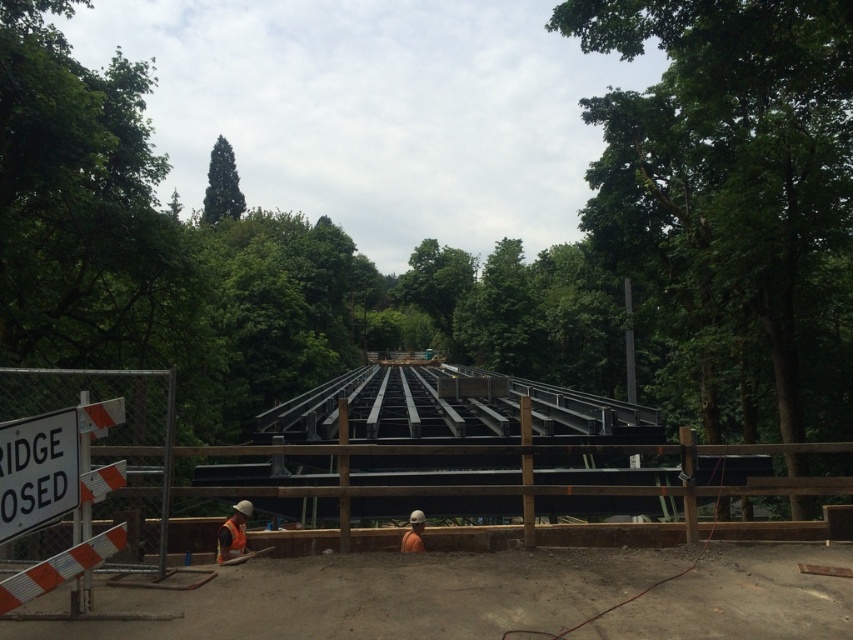
Question: Which object appears closest to the camera in this image?

Choices:
 (A) orange safety vest at lower center
 (B) black steel beams at center
 (C) orange fabric safety vest at lower center

Answer: (B)

Question: Among these objects, which one is nearest to the camera?

Choices:
 (A) orange fabric safety vest at lower center
 (B) orange safety vest at lower center
 (C) black steel beams at center

Answer: (C)

Question: Which point is farther to the camera?

Choices:
 (A) orange safety vest at lower center
 (B) orange fabric safety vest at lower center

Answer: (A)

Question: Does black steel beams at center appear over orange fabric safety vest at lower center?

Choices:
 (A) no
 (B) yes

Answer: (A)

Question: Does orange fabric safety vest at lower center appear over orange safety vest at lower center?

Choices:
 (A) yes
 (B) no

Answer: (A)

Question: Can you confirm if black steel beams at center is wider than orange fabric safety vest at lower center?

Choices:
 (A) no
 (B) yes

Answer: (B)